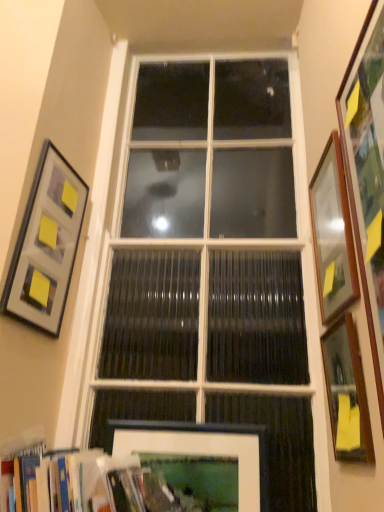
Question: In the image, is wooden bookshelf at lower left positioned in front of or behind white matte picture frame at lower center, the 2th picture frame when ordered from left to right?

Choices:
 (A) behind
 (B) front

Answer: (B)

Question: From the image's perspective, relative to white matte picture frame at lower center, which is counted as the fourth picture frame, starting from the right, is wooden bookshelf at lower left above or below?

Choices:
 (A) above
 (B) below

Answer: (A)

Question: Estimate the real-world distances between objects in this image. Which object is closer to the white matte picture frame at lower center, which is counted as the fourth picture frame, starting from the right?

Choices:
 (A) white glass window at center
 (B) wooden picture frame at right, arranged as the first picture frame when viewed from the right
 (C) wooden framed mirror at right, the fourth picture frame in the left-to-right sequence
 (D) wooden picture frame at right, the third picture frame viewed from the left
 (E) wooden bookshelf at lower left

Answer: (E)

Question: Which of these objects is positioned closest to the white glass window at center?

Choices:
 (A) wooden bookshelf at lower left
 (B) wooden picture frame at right, the third picture frame viewed from the left
 (C) wooden framed mirror at right, the 2th picture frame viewed from the right
 (D) matte gray picture frame at upper left, arranged as the 5th picture frame when viewed from the right
 (E) wooden picture frame at right, the 5th picture frame in the left-to-right sequence

Answer: (D)